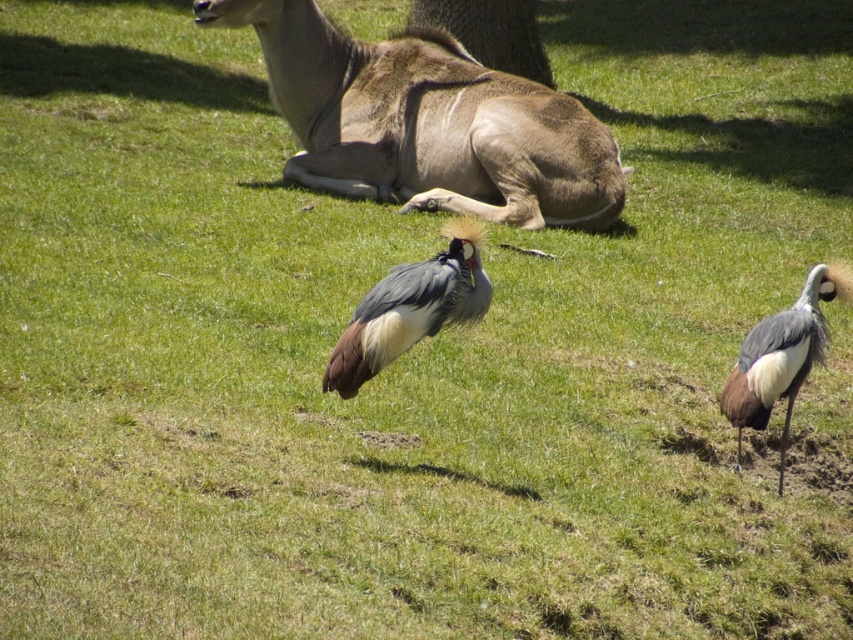
You are an ornithologist observing the scene. You notice a point at coordinates (410, 308). Which object from the list is located at that point?

The gray feathered bird at center is located at point (410, 308).

Consider the image. You are a wildlife photographer aiming to capture a photo of the brown fur deer at upper center and the gray matte bird at right. Based on their sizes, which animal should you focus on first if you want to ensure both are in frame without zooming in or out?

The brown fur deer at upper center is wider than the gray matte bird at right, so you should focus on the brown fur deer at upper center first to ensure both fit in the frame.